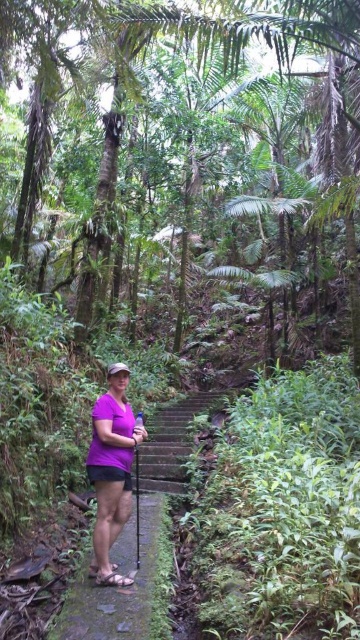
You are a hiker who wants to follow the brown stone trail at center. According to the map, the trail is marked at coordinates point 0.920, 0.331. Where should you look to find the trail?

The brown stone trail at center is located at point (x=119, y=588), so you should look towards the center of the image to find it.

You are a hiker carrying a backpack and need to walk along the path in the image. The brown stone trail at center and purple matte shirt at center are both in your view. Can you estimate if the trail is wide enough for you to walk comfortably without stepping off the path?

The brown stone trail at center is wider than the purple matte shirt at center, so the trail is likely wide enough for you to walk comfortably without stepping off the path.

You are a hiker who wants to follow the brown stone trail at center. Where should you stand relative to the purple matte shirt at center?

The brown stone trail at center is in front of the purple matte shirt at center, so you should stand behind the purple matte shirt at center to follow the trail.